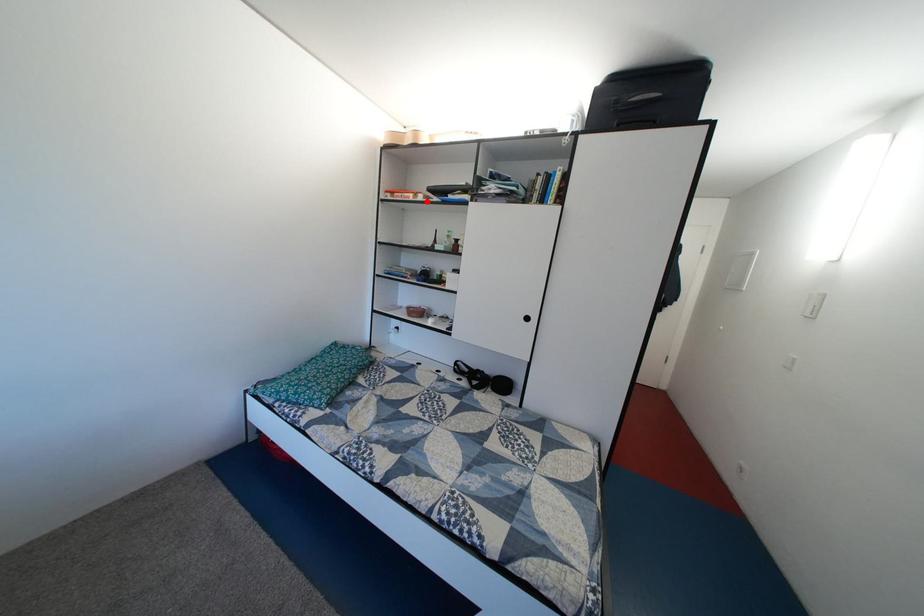
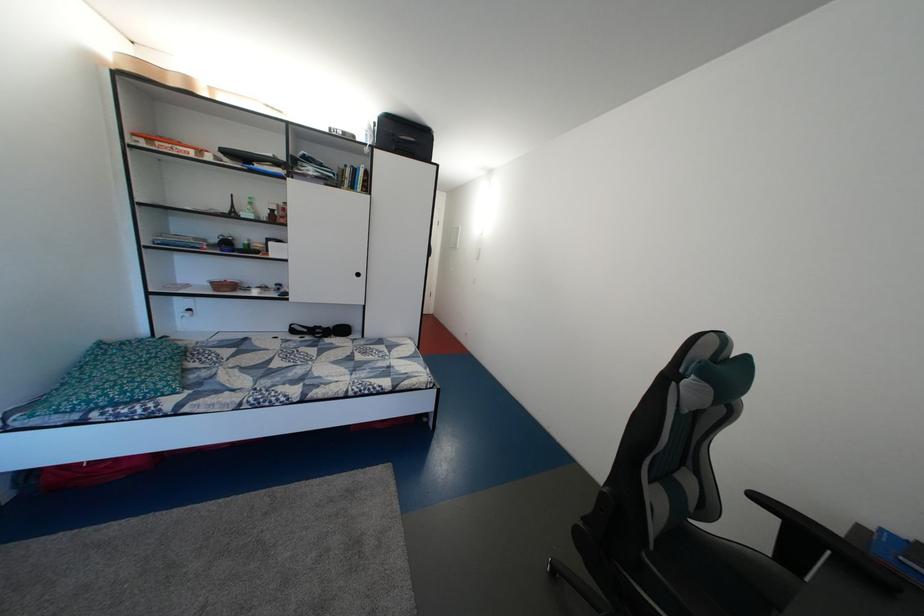
Question: I am providing you with two images of the same scene from different viewpoints. A red point is shown in image1. For the corresponding object point in image2, is it positioned nearer or farther from the camera?

Choices:
 (A) Nearer
 (B) Farther

Answer: (B)